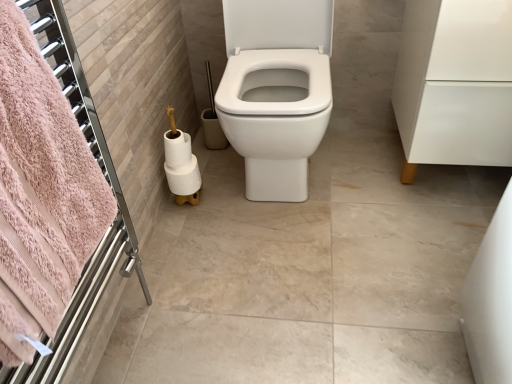
What do you see at coordinates (184, 178) in the screenshot?
I see `white matte toilet paper at lower left, which is the first toilet paper in bottom-to-top order` at bounding box center [184, 178].

The width and height of the screenshot is (512, 384). Identify the location of pink terry cloth towel at left. 45,193.

Describe the element at coordinates (177, 148) in the screenshot. I see `white matte toilet paper at lower left, which is the 1th toilet paper from top to bottom` at that location.

You are a GUI agent. You are given a task and a screenshot of the screen. Output one action in this format:
    pyautogui.click(x=<x>, y=<y>)
    Task: Click on the white glossy cabinet at right
    This screenshot has height=384, width=512.
    Given the screenshot: What is the action you would take?
    (455, 83)

Can you tell me how much white matte toilet paper at lower left, positioned as the third toilet paper in bottom-to-top order, and pink terry cloth towel at left differ in facing direction?

There is a 86.3-degree angle between the facing directions of white matte toilet paper at lower left, positioned as the third toilet paper in bottom-to-top order, and pink terry cloth towel at left.

Does white matte toilet paper at lower left, which is the 1th toilet paper from top to bottom, have a smaller size compared to pink terry cloth towel at left?

Correct, white matte toilet paper at lower left, which is the 1th toilet paper from top to bottom, occupies less space than pink terry cloth towel at left.

What are the coordinates of `bath towel positioned vertically above the white matte toilet paper at lower left, which is the 1th toilet paper from top to bottom (from a real-world perspective)` in the screenshot? It's located at (45, 193).

Who is taller, white matte toilet paper at lower left, which is the 1th toilet paper from top to bottom, or pink terry cloth towel at left?

With more height is pink terry cloth towel at left.

Is white matte toilet paper at lower left, positioned as the third toilet paper in bottom-to-top order, inside or outside of white glossy toilet at center?

white matte toilet paper at lower left, positioned as the third toilet paper in bottom-to-top order, is spatially situated outside white glossy toilet at center.

Can you tell me how much white matte toilet paper at lower left, which is the 1th toilet paper from top to bottom, and white glossy toilet at center differ in facing direction?

white matte toilet paper at lower left, which is the 1th toilet paper from top to bottom, and white glossy toilet at center are facing 1.76 degrees away from each other.

From a real-world perspective, which object rests below the other?

white matte toilet paper at lower left, positioned as the third toilet paper in bottom-to-top order, from a real-world perspective.

Can you confirm if white matte toilet paper at lower left, positioned as the third toilet paper in bottom-to-top order, is thinner than white glossy toilet at center?

Indeed, white matte toilet paper at lower left, positioned as the third toilet paper in bottom-to-top order, has a lesser width compared to white glossy toilet at center.

There is a white matte toilet paper at lower left, which is the 1th toilet paper from top to bottom. At what (x,y) coordinates should I click in order to perform the action: click on bath towel above it (from a real-world perspective). Please return your answer as a coordinate pair (x, y). This screenshot has height=384, width=512. Looking at the image, I should click on (45, 193).

Considering the positions of objects pink terry cloth towel at left and white matte toilet paper at lower left, positioned as the third toilet paper in bottom-to-top order, in the image provided, who is in front, pink terry cloth towel at left or white matte toilet paper at lower left, positioned as the third toilet paper in bottom-to-top order,?

pink terry cloth towel at left is in front.

Is point (4, 149) closer or farther from the camera than point (186, 152)?

Clearly, point (4, 149) is closer to the camera than point (186, 152).

Is white glossy cabinet at right taller or shorter than white glossy toilet at center?

Considering their sizes, white glossy cabinet at right has less height than white glossy toilet at center.

Between point (414, 144) and point (293, 149), which one is positioned in front?

The point (293, 149) is in front.

From the image's perspective, is white glossy cabinet at right above white glossy toilet at center?

Incorrect, from the image's perspective, white glossy cabinet at right is lower than white glossy toilet at center.

How many degrees apart are the facing directions of white glossy cabinet at right and pink terry cloth towel at left?

88.2 degrees separate the facing orientations of white glossy cabinet at right and pink terry cloth towel at left.

From a real-world perspective, is white glossy cabinet at right located higher than pink terry cloth towel at left?

No, from a real-world perspective, white glossy cabinet at right is not above pink terry cloth towel at left.

Locate an element on the screen. This screenshot has width=512, height=384. porcelain lying on the right of pink terry cloth towel at left is located at coordinates pyautogui.click(x=455, y=83).

Between point (167, 178) and point (438, 153), which one is positioned behind?

The point (167, 178) is farther.

Consider the image. Is there a large distance between white matte toilet paper at lower left, positioned as the third toilet paper in top-to-bottom order, and white glossy cabinet at right?

They are positioned close to each other.

Is white matte toilet paper at lower left, which is the first toilet paper in bottom-to-top order, completely or partially outside of white glossy cabinet at right?

white matte toilet paper at lower left, which is the first toilet paper in bottom-to-top order, lies outside white glossy cabinet at right's area.

Is white matte toilet paper at lower left, positioned as the third toilet paper in top-to-bottom order, to the left of white glossy cabinet at right from the viewer's perspective?

Yes.

From the picture: Is white matte toilet paper at lower left, positioned as the third toilet paper in bottom-to-top order, directly adjacent to white matte toilet paper at lower left, which is the first toilet paper in bottom-to-top order?

Yes, white matte toilet paper at lower left, positioned as the third toilet paper in bottom-to-top order, and white matte toilet paper at lower left, which is the first toilet paper in bottom-to-top order, clearly make contact.

Can white matte toilet paper at lower left, which is the first toilet paper in bottom-to-top order, be found inside white matte toilet paper at lower left, which is the 1th toilet paper from top to bottom?

No, white matte toilet paper at lower left, which is the 1th toilet paper from top to bottom, does not contain white matte toilet paper at lower left, which is the first toilet paper in bottom-to-top order.

Is the depth of white matte toilet paper at lower left, which is the 1th toilet paper from top to bottom, less than that of white matte toilet paper at lower left, positioned as the third toilet paper in top-to-bottom order?

Yes, white matte toilet paper at lower left, which is the 1th toilet paper from top to bottom, is closer to the camera.

Which is in front, point (169, 150) or point (185, 174)?

The point (169, 150) is in front.

Identify the location of the 2nd toilet paper behind when counting from the pink terry cloth towel at left. The width and height of the screenshot is (512, 384). (177, 148).

Where is `the 2nd toilet paper counting from the left of the white glossy toilet at center`? The image size is (512, 384). the 2nd toilet paper counting from the left of the white glossy toilet at center is located at coordinates (177, 148).

Looking at the image, which one is located closer to white matte toilet paper at lower left, positioned as the 2th toilet paper in bottom-to-top order, pink terry cloth towel at left or white matte toilet paper at lower left, positioned as the third toilet paper in bottom-to-top order?

Based on the image, white matte toilet paper at lower left, positioned as the third toilet paper in bottom-to-top order, appears to be nearer to white matte toilet paper at lower left, positioned as the 2th toilet paper in bottom-to-top order.

In the scene shown: Which object lies further to the anchor point pink terry cloth towel at left, white matte toilet paper at lower left, positioned as the third toilet paper in top-to-bottom order, or white glossy toilet at center?

Among the two, white matte toilet paper at lower left, positioned as the third toilet paper in top-to-bottom order, is located further to pink terry cloth towel at left.

Estimate the real-world distances between objects in this image. Which object is further from pink terry cloth towel at left, white matte toilet paper at lower left, the second toilet paper from the top, or white glossy toilet at center?

white glossy toilet at center is further to pink terry cloth towel at left.

From the image, which object appears to be farther from white matte toilet paper at lower left, positioned as the third toilet paper in top-to-bottom order, white glossy cabinet at right or white matte toilet paper at lower left, the second toilet paper from the top?

Answer: white glossy cabinet at right.

Looking at the image, which one is located further to white glossy toilet at center, white matte toilet paper at lower left, the second toilet paper from the top, or white matte toilet paper at lower left, positioned as the third toilet paper in top-to-bottom order?

Among the two, white matte toilet paper at lower left, positioned as the third toilet paper in top-to-bottom order, is located further to white glossy toilet at center.

Looking at the image, which one is located further to white glossy cabinet at right, white matte toilet paper at lower left, positioned as the third toilet paper in top-to-bottom order, or white glossy toilet at center?

white matte toilet paper at lower left, positioned as the third toilet paper in top-to-bottom order, is further to white glossy cabinet at right.

Considering their positions, is white matte toilet paper at lower left, positioned as the third toilet paper in top-to-bottom order, positioned closer to white matte toilet paper at lower left, positioned as the 2th toilet paper in bottom-to-top order, than white glossy toilet at center?

Among the two, white matte toilet paper at lower left, positioned as the third toilet paper in top-to-bottom order, is located nearer to white matte toilet paper at lower left, positioned as the 2th toilet paper in bottom-to-top order.

Estimate the real-world distances between objects in this image. Which object is further from white glossy cabinet at right, white glossy toilet at center or white matte toilet paper at lower left, the second toilet paper from the top?

white matte toilet paper at lower left, the second toilet paper from the top, is positioned further to the anchor white glossy cabinet at right.

Where is `bidet between pink terry cloth towel at left and white glossy cabinet at right from left to right`? Image resolution: width=512 pixels, height=384 pixels. bidet between pink terry cloth towel at left and white glossy cabinet at right from left to right is located at coordinates (275, 117).

Where is `bidet between pink terry cloth towel at left and white matte toilet paper at lower left, which is the 1th toilet paper from top to bottom, in the front-back direction`? This screenshot has height=384, width=512. bidet between pink terry cloth towel at left and white matte toilet paper at lower left, which is the 1th toilet paper from top to bottom, in the front-back direction is located at coordinates (275, 117).

At what (x,y) coordinates should I click in order to perform the action: click on bidet between pink terry cloth towel at left and white matte toilet paper at lower left, positioned as the third toilet paper in top-to-bottom order, along the z-axis. Please return your answer as a coordinate pair (x, y). The width and height of the screenshot is (512, 384). Looking at the image, I should click on (275, 117).

Where is `toilet paper positioned between white glossy toilet at center and white matte toilet paper at lower left, positioned as the third toilet paper in bottom-to-top order, from near to far`? toilet paper positioned between white glossy toilet at center and white matte toilet paper at lower left, positioned as the third toilet paper in bottom-to-top order, from near to far is located at coordinates (181, 164).